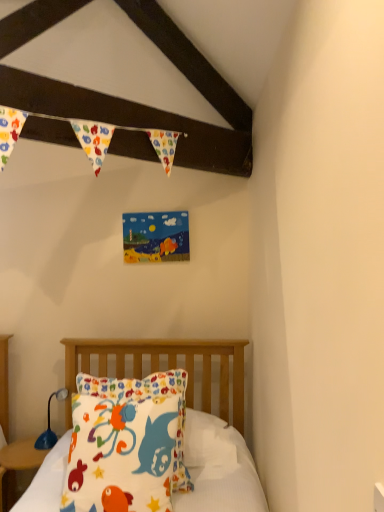
Locate an element on the screen. free spot above matte wood nightstand at lower left (from a real-world perspective) is located at coordinates (29, 448).